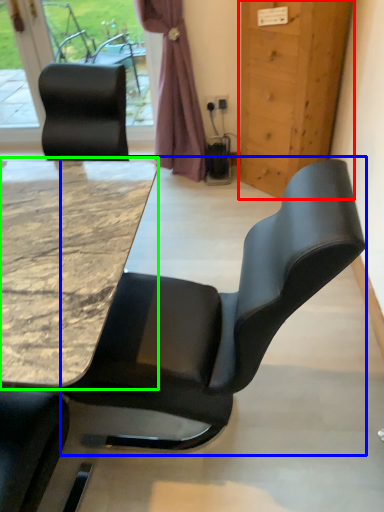
Question: Which is nearer to the door (highlighted by a red box)? chair (highlighted by a blue box) or table (highlighted by a green box).

Choices:
 (A) chair
 (B) table

Answer: (B)